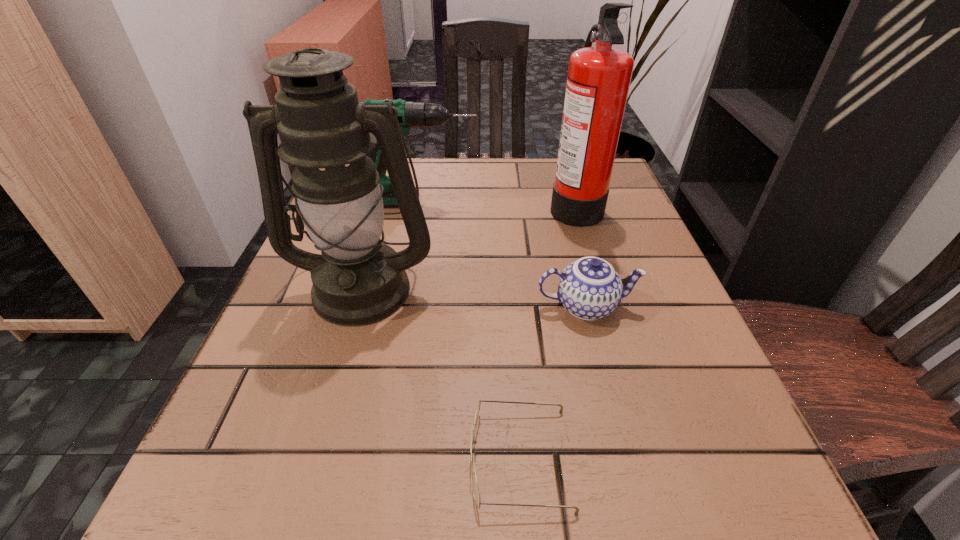
Locate an element on the screen. The image size is (960, 540). chinaware present at the right edge is located at coordinates (590, 288).

Where is `object that is at the far left corner`? The width and height of the screenshot is (960, 540). object that is at the far left corner is located at coordinates (410, 114).

Find the location of a particular element. The image size is (960, 540). object present at the far right corner is located at coordinates (599, 77).

Find the location of a particular element. vacant space at the far edge of the desktop is located at coordinates (539, 198).

Locate an element on the screen. This screenshot has height=540, width=960. free space at the left edge of the desktop is located at coordinates (388, 216).

In the image, there is a desktop. Where is `vacant space at the right edge`? This screenshot has width=960, height=540. vacant space at the right edge is located at coordinates (x=571, y=244).

Find the location of a particular element. empty space that is in between the oil lamp and the chinaware is located at coordinates (474, 297).

Locate an element on the screen. unoccupied area between the drill and the nearest object is located at coordinates (469, 330).

Where is `unoccupied position between the oil lamp and the spectacles`? The width and height of the screenshot is (960, 540). unoccupied position between the oil lamp and the spectacles is located at coordinates pyautogui.click(x=442, y=373).

Where is `empty space between the oil lamp and the shortest object`? This screenshot has height=540, width=960. empty space between the oil lamp and the shortest object is located at coordinates (442, 373).